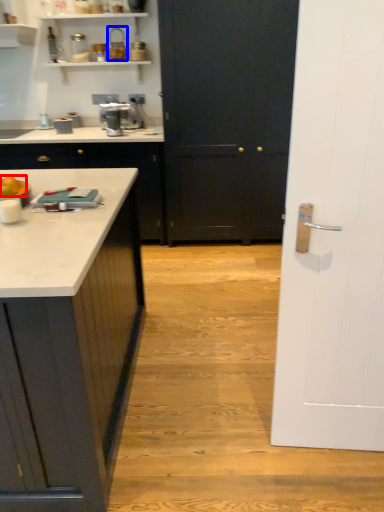
Question: Which point is further to the camera, food (highlighted by a red box) or appliance (highlighted by a blue box)?

Choices:
 (A) food
 (B) appliance

Answer: (B)